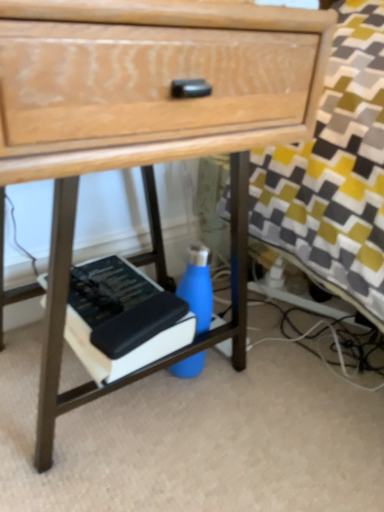
Locate an element on the screen. This screenshot has height=512, width=384. free space above hardcover book at lower center (from a real-world perspective) is located at coordinates click(x=113, y=287).